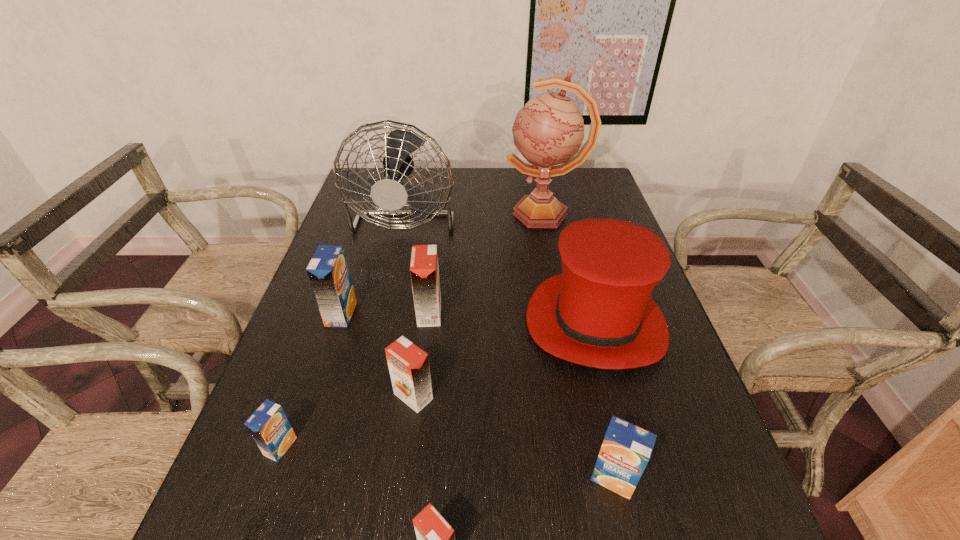
Find the location of a particular element. This screenshot has width=960, height=540. the tallest object is located at coordinates (549, 129).

Locate an element on the screen. The width and height of the screenshot is (960, 540). globe is located at coordinates (549, 129).

At what (x,y) coordinates should I click in order to perform the action: click on the second tallest object. Please return your answer as a coordinate pair (x, y). Image resolution: width=960 pixels, height=540 pixels. Looking at the image, I should click on (390, 194).

Find the location of a particular element. Image resolution: width=960 pixels, height=540 pixels. red hat is located at coordinates (599, 312).

In order to click on hat in this screenshot , I will do click(x=599, y=312).

The height and width of the screenshot is (540, 960). Identify the location of the farthest blue orange_juice. (328, 272).

Find the location of a particular element. Image resolution: width=960 pixels, height=540 pixels. the farthest orange orange juice is located at coordinates (424, 270).

I want to click on the second biggest orange orange juice, so pos(408,364).

You are a GUI agent. You are given a task and a screenshot of the screen. Output one action in this format:
    pyautogui.click(x=<x>, y=<y>)
    Task: Click on the fourth nearest object
    The width and height of the screenshot is (960, 540).
    Given the screenshot: What is the action you would take?
    pyautogui.click(x=408, y=364)

Locate an element on the screen. This screenshot has width=960, height=540. the second biggest blue orange_juice is located at coordinates (626, 449).